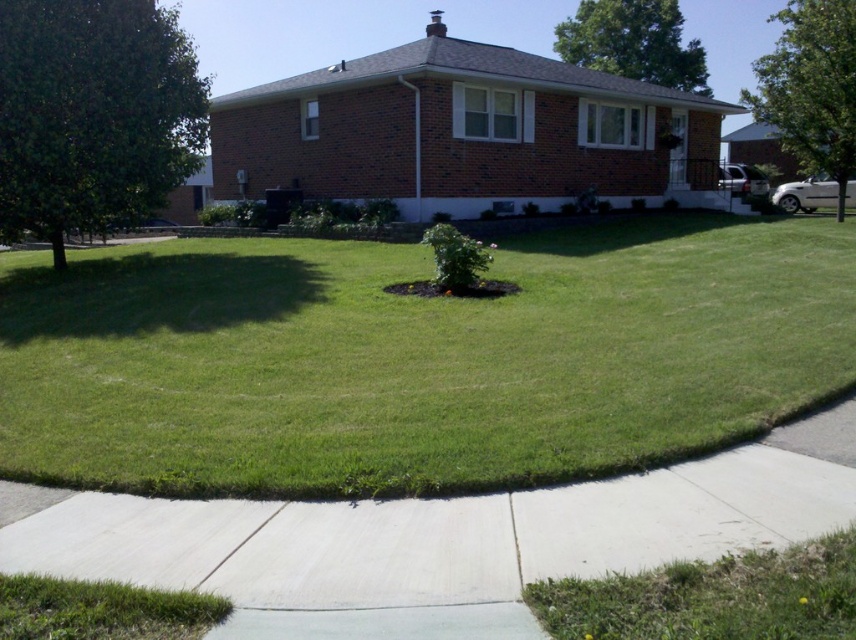
You are planning to install a new garden shed in your backyard. You want to place it between the green leafy tree at right and the green leafy tree at upper right. Considering their sizes, which tree should you avoid placing the shed too close to?

You should avoid placing the shed too close to the green leafy tree at right because it has a larger size compared to the green leafy tree at upper right, which means it may have a larger root system and canopy that could interfere with the shed placement.

You are a gardener planning to trim both the green leafy tree at right and the green leafy tree at upper right. Based on their heights, which tree will require a taller ladder to reach the top?

The green leafy tree at right is taller than the green leafy tree at upper right, so it will require a taller ladder to reach the top.

You are a gardener planning to mow the lawn. You notice two areas of green grass at center and green grass at lower right. Which area requires a wider mower path to cover its width?

The green grass at center requires a wider mower path because its width surpasses that of the green grass at lower right.